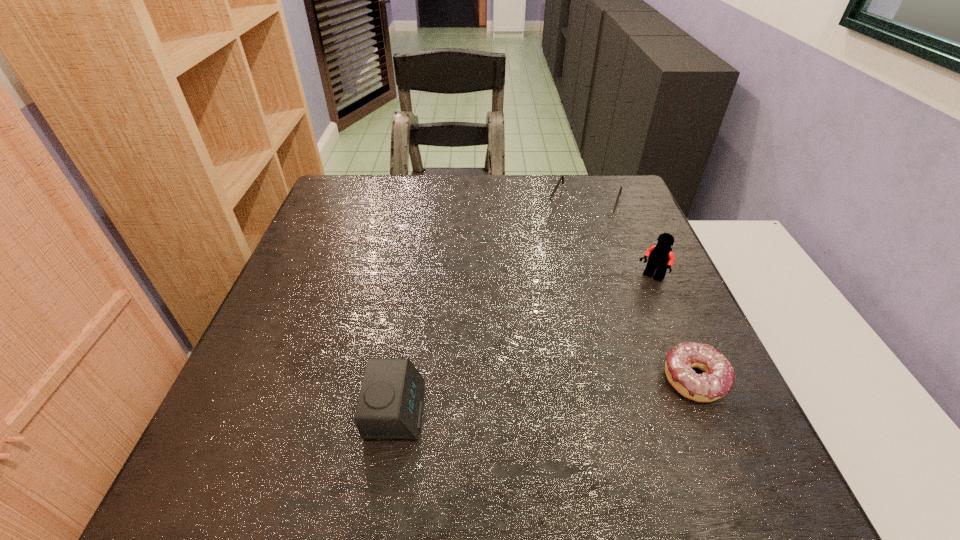
This screenshot has height=540, width=960. Find the location of `free space on the desktop that is between the third shortest object and the doughnut and is positioned on the front-facing side of the second farthest object`. free space on the desktop that is between the third shortest object and the doughnut and is positioned on the front-facing side of the second farthest object is located at coordinates (541, 395).

Locate an element on the screen. free space on the desktop that is between the second tallest object and the doughnut and is positioned at the hinge ends of the spectacles is located at coordinates (506, 399).